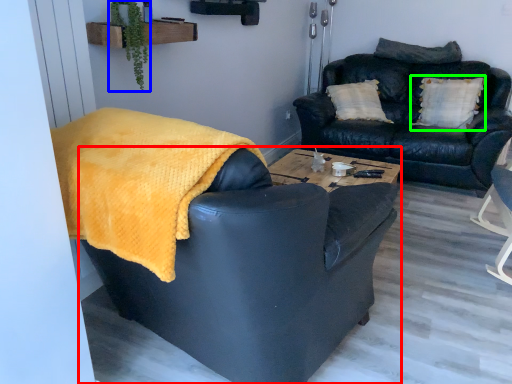
Question: Based on their relative distances, which object is nearer to chair (highlighted by a red box)? Choose from plant (highlighted by a blue box) and pillow (highlighted by a green box).

Choices:
 (A) plant
 (B) pillow

Answer: (A)